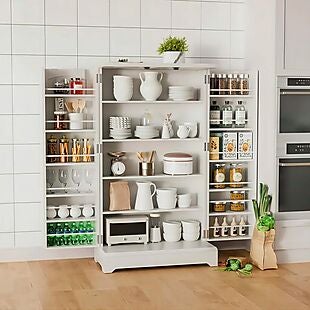
This screenshot has width=310, height=310. I want to click on dishes (bowls, plates), so click(168, 226), click(187, 227), click(187, 198), click(144, 131), click(120, 126), click(184, 88), click(123, 84).